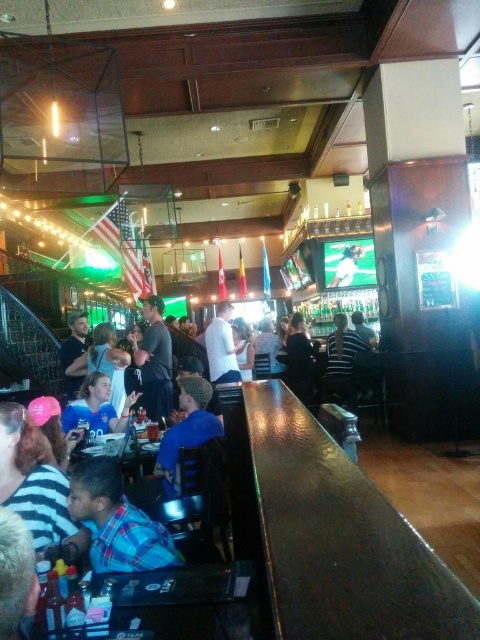
Question: Is wooden table at lower center to the right of dark gray shirt at center from the viewer's perspective?

Choices:
 (A) yes
 (B) no

Answer: (A)

Question: Which point appears farthest from the camera in this image?

Choices:
 (A) pos(118,460)
 (B) pos(169,401)
 (C) pos(107,387)

Answer: (B)

Question: Which of the following is the closest to the observer?

Choices:
 (A) wooden table at lower center
 (B) wooden table at center
 (C) shiny brown wood bar at center
 (D) plaid shirt at lower left

Answer: (C)

Question: Is wooden table at lower center positioned behind wooden table at center?

Choices:
 (A) no
 (B) yes

Answer: (A)

Question: Which object is the closest to the shiny brown wood bar at center?

Choices:
 (A) wooden table at lower center
 (B) green fabric shirt at center
 (C) wooden table at center
 (D) blue jersey at center

Answer: (A)

Question: Considering the relative positions of plaid shirt at lower left and green fabric shirt at center in the image provided, where is plaid shirt at lower left located with respect to green fabric shirt at center?

Choices:
 (A) left
 (B) right

Answer: (A)